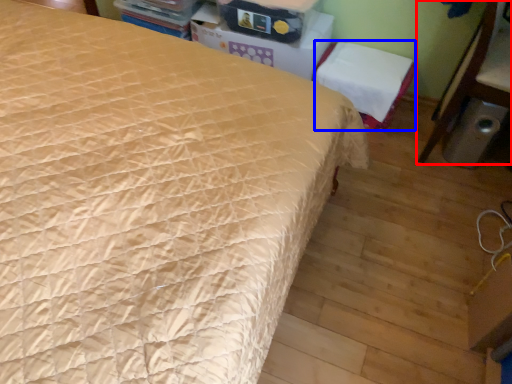
Question: Among these objects, which one is nearest to the camera, furniture (highlighted by a red box) or chair (highlighted by a blue box)?

Choices:
 (A) furniture
 (B) chair

Answer: (A)